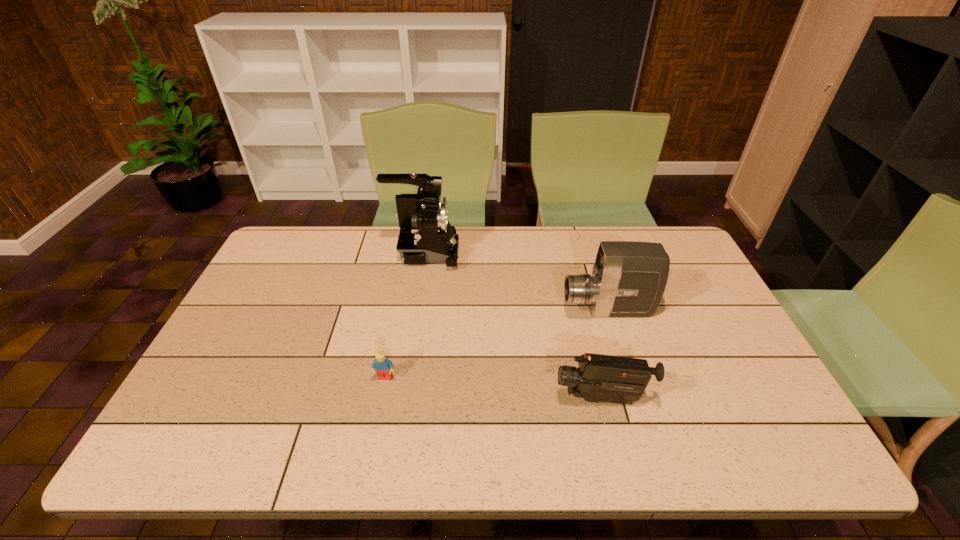
The image size is (960, 540). I want to click on vacant space in between the second nearest object and the second tallest camcorder, so click(496, 344).

You are a GUI agent. You are given a task and a screenshot of the screen. Output one action in this format:
    pyautogui.click(x=<x>, y=<y>)
    Task: Click on the blank region between the shortest object and the third shortest object
    
    Given the screenshot: What is the action you would take?
    pyautogui.click(x=496, y=344)

You are a GUI agent. You are given a task and a screenshot of the screen. Output one action in this format:
    pyautogui.click(x=<x>, y=<y>)
    Task: Click on the empty location between the Lego and the second shortest object
    
    Given the screenshot: What is the action you would take?
    pyautogui.click(x=493, y=388)

The width and height of the screenshot is (960, 540). Find the location of `the closest object relative to the farthest camcorder`. the closest object relative to the farthest camcorder is located at coordinates (629, 278).

Image resolution: width=960 pixels, height=540 pixels. What are the coordinates of `object that ranks as the second closest to the shortest camcorder` in the screenshot? It's located at (382, 365).

Identify which camcorder is located as the second nearest to the nearest object. Please provide its 2D coordinates. Your answer should be formatted as a tuple, i.e. [(x, y)], where the tuple contains the x and y coordinates of a point satisfying the conditions above.

[(426, 236)]

You are a GUI agent. You are given a task and a screenshot of the screen. Output one action in this format:
    pyautogui.click(x=<x>, y=<y>)
    Task: Click on the camcorder that is the second closest to the tallest camcorder
    The height and width of the screenshot is (540, 960).
    Given the screenshot: What is the action you would take?
    pyautogui.click(x=599, y=378)

Locate an element on the screen. vacant position in the image that satisfies the following two spatial constraints: 1. on the lens mount of the tallest camcorder; 2. on the face of the Lego is located at coordinates (405, 377).

Find the location of a particular element. The width and height of the screenshot is (960, 540). free region that satisfies the following two spatial constraints: 1. on the lens mount of the leftmost camcorder; 2. on the face of the third farthest object is located at coordinates (405, 377).